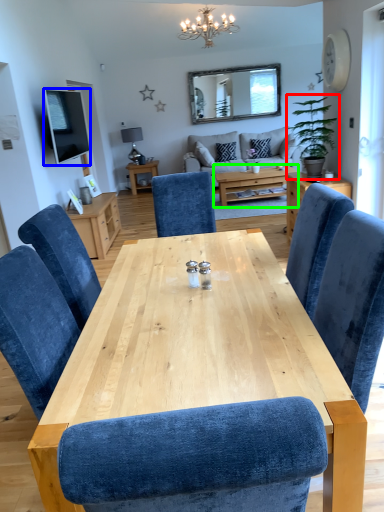
Question: Which is farther away from houseplant (highlighted by a red box)? television (highlighted by a blue box) or coffee table (highlighted by a green box)?

Choices:
 (A) television
 (B) coffee table

Answer: (A)